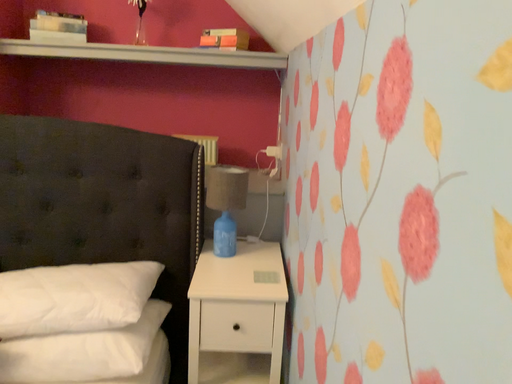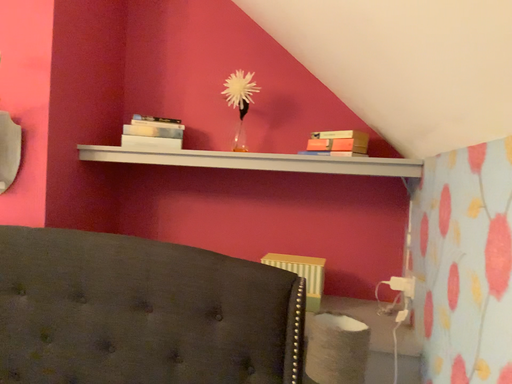
Question: Which way did the camera rotate in the video?

Choices:
 (A) rotated upward
 (B) rotated downward

Answer: (A)